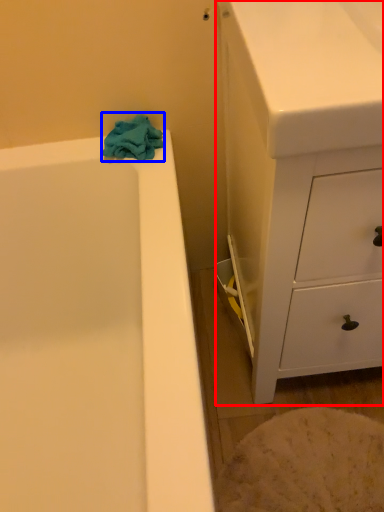
Question: Which of the following is the farthest to the observer, chest of drawers (highlighted by a red box) or bath towel (highlighted by a blue box)?

Choices:
 (A) chest of drawers
 (B) bath towel

Answer: (B)